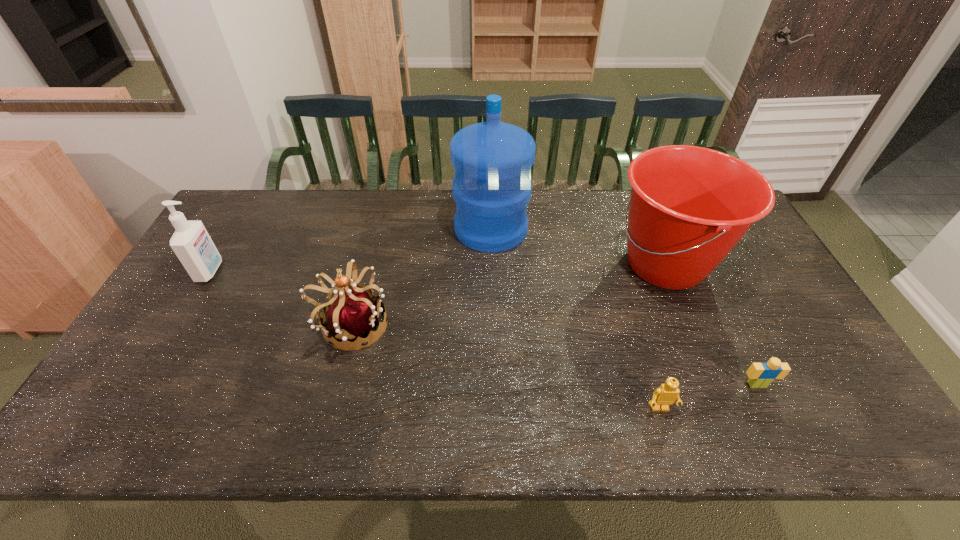
The width and height of the screenshot is (960, 540). I want to click on the farther Lego, so click(761, 375).

In order to click on vacant space located on the right of the fourth object from right to left in this screenshot , I will do `click(585, 229)`.

Locate an element on the screen. vacant region located with the handle attached to the rim of the bucket is located at coordinates pos(477,265).

In order to click on vacant space positioned 0.170m with the handle attached to the rim of the bucket in this screenshot , I will do `click(551, 265)`.

This screenshot has width=960, height=540. I want to click on free space located with the handle attached to the rim of the bucket, so click(x=480, y=265).

Locate an element on the screen. This screenshot has height=540, width=960. vacant space situated on the front label of the leftmost object is located at coordinates (303, 271).

In order to click on vacant region located 0.300m on the front-facing side of the tiara in this screenshot , I will do `click(501, 325)`.

This screenshot has width=960, height=540. In order to click on free region located on the face of the right Lego in this screenshot , I will do `click(785, 442)`.

Where is `water jug that is at the far edge`? Image resolution: width=960 pixels, height=540 pixels. water jug that is at the far edge is located at coordinates (491, 188).

Locate an element on the screen. The image size is (960, 540). bucket present at the far edge is located at coordinates (689, 206).